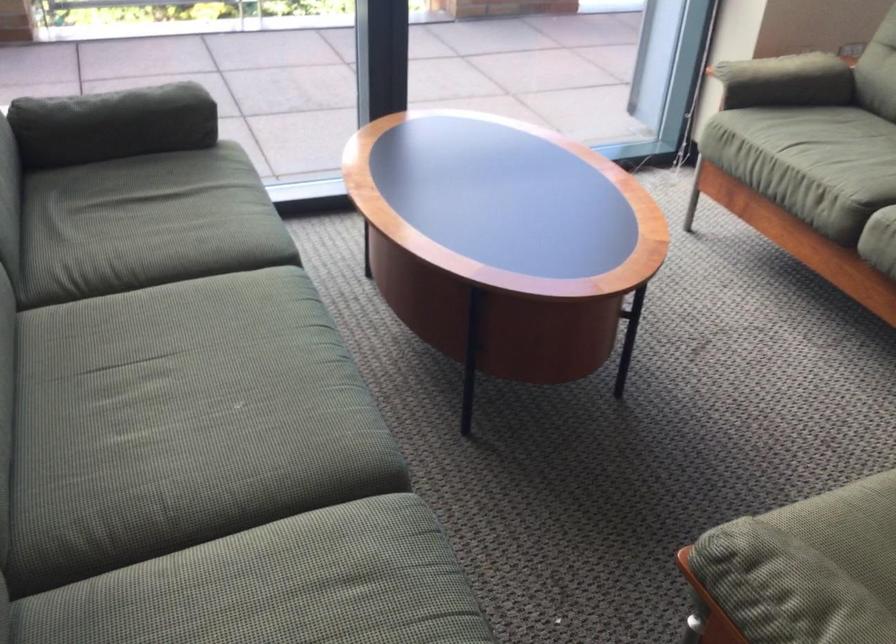
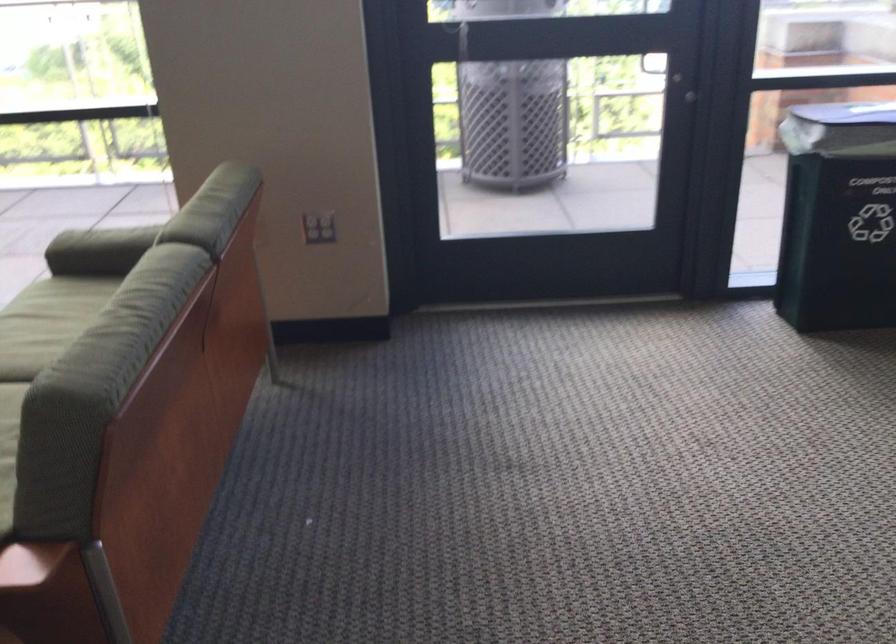
The point at [754,100] is marked in the first image. Where is the corresponding point in the second image?

(99, 247)